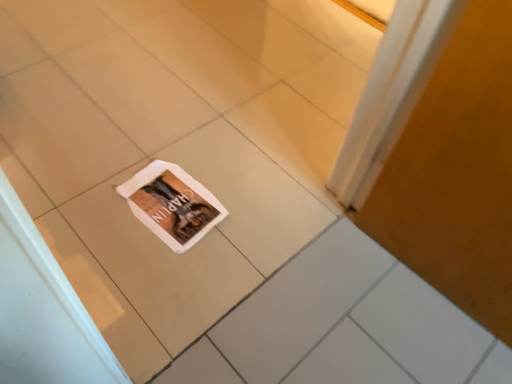
Locate an element on the screen. free spot to the right of white paper postcard at center is located at coordinates (250, 213).